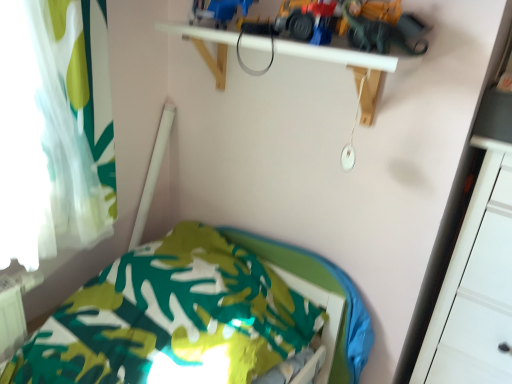
This screenshot has width=512, height=384. Describe the element at coordinates (194, 315) in the screenshot. I see `green fabric bed at lower left` at that location.

Image resolution: width=512 pixels, height=384 pixels. I want to click on white matte shelf at upper center, so click(x=323, y=53).

Locate an element on the screen. blue plastic toy truck at upper center, the second toy in the right-to-left sequence is located at coordinates (218, 11).

What is the approximate width of yellow plastic toy car at upper center, arranged as the first toy car when viewed from the right?

yellow plastic toy car at upper center, arranged as the first toy car when viewed from the right, is 1.45 inches in width.

What do you see at coordinates (476, 293) in the screenshot? I see `white glossy drawer at right` at bounding box center [476, 293].

This screenshot has width=512, height=384. What do you see at coordinates (72, 119) in the screenshot? I see `white sheer curtain at left` at bounding box center [72, 119].

Where is `green fabric bed at lower left`? Image resolution: width=512 pixels, height=384 pixels. green fabric bed at lower left is located at coordinates (194, 315).

From their relative heights in the image, would you say white sheer curtain at left is taller or shorter than white matte shelf at upper center?

Clearly, white sheer curtain at left is taller compared to white matte shelf at upper center.

Is white matte shelf at upper center at the back of white sheer curtain at left?

No, white matte shelf at upper center is not at the back of white sheer curtain at left.

Is white sheer curtain at left completely or partially outside of white matte shelf at upper center?

Yes, white sheer curtain at left is located beyond the bounds of white matte shelf at upper center.

Consider the image. From the image's perspective, is white sheer curtain at left located beneath white matte shelf at upper center?

Yes.

Does point (482, 284) come farther from viewer compared to point (404, 42)?

That is True.

Image resolution: width=512 pixels, height=384 pixels. Find the location of `toy car that is the 1st object to the left of the white glossy drawer at right, starting at the anchor`. toy car that is the 1st object to the left of the white glossy drawer at right, starting at the anchor is located at coordinates (383, 27).

Between white glossy drawer at right and yellow plastic toy car at upper center, arranged as the first toy car when viewed from the right, which one has smaller size?

yellow plastic toy car at upper center, arranged as the first toy car when viewed from the right, is smaller.

Can you confirm if white glossy drawer at right is positioned to the right of yellow plastic toy car at upper center, placed as the second toy car when sorted from left to right?

Yes.

From a real-world perspective, relative to white glossy drawer at right, is yellow plastic toy car at upper center, arranged as the first toy car when viewed from the right, vertically above or below?

From a real-world perspective, yellow plastic toy car at upper center, arranged as the first toy car when viewed from the right, is physically above white glossy drawer at right.

Is yellow plastic toy car at upper center, arranged as the first toy car when viewed from the right, at the right side of white glossy drawer at right?

In fact, yellow plastic toy car at upper center, arranged as the first toy car when viewed from the right, is to the left of white glossy drawer at right.

Image resolution: width=512 pixels, height=384 pixels. I want to click on drawer directly beneath the yellow plastic toy car at upper center, arranged as the first toy car when viewed from the right (from a real-world perspective), so [x=476, y=293].

Which object is closer to the camera, yellow plastic toy car at upper center, arranged as the first toy car when viewed from the right, or white glossy drawer at right?

yellow plastic toy car at upper center, arranged as the first toy car when viewed from the right, is in front.

From the image's perspective, is metallic yellow construction vehicle at upper center, the 1th toy in the right-to-left sequence, above or below matte red toy car at upper center, the 2th toy car viewed from the right?

From the image's perspective, metallic yellow construction vehicle at upper center, the 1th toy in the right-to-left sequence, appears above matte red toy car at upper center, the 2th toy car viewed from the right.

Is metallic yellow construction vehicle at upper center, the 1th toy in the right-to-left sequence, in contact with matte red toy car at upper center, the 1th toy car positioned from the left?

Yes, metallic yellow construction vehicle at upper center, the 1th toy in the right-to-left sequence, is beside matte red toy car at upper center, the 1th toy car positioned from the left.

Consider the image. Is metallic yellow construction vehicle at upper center, the 1th toy in the right-to-left sequence, facing towards matte red toy car at upper center, the 2th toy car viewed from the right?

Yes, metallic yellow construction vehicle at upper center, the 1th toy in the right-to-left sequence, is facing matte red toy car at upper center, the 2th toy car viewed from the right.

Is metallic yellow construction vehicle at upper center, which is the second toy in left-to-right order, spatially inside matte red toy car at upper center, the 2th toy car viewed from the right, or outside of it?

metallic yellow construction vehicle at upper center, which is the second toy in left-to-right order, is not inside matte red toy car at upper center, the 2th toy car viewed from the right, it's outside.

Considering the relative positions of blue plastic toy truck at upper center, the 1th toy positioned from the left, and matte red toy car at upper center, the 2th toy car viewed from the right, in the image provided, is blue plastic toy truck at upper center, the 1th toy positioned from the left, to the left of matte red toy car at upper center, the 2th toy car viewed from the right, from the viewer's perspective?

Yes.

Are blue plastic toy truck at upper center, the second toy in the right-to-left sequence, and matte red toy car at upper center, the 1th toy car positioned from the left, making contact?

No, blue plastic toy truck at upper center, the second toy in the right-to-left sequence, is not making contact with matte red toy car at upper center, the 1th toy car positioned from the left.

Choose the correct answer: Is blue plastic toy truck at upper center, the 1th toy positioned from the left, inside matte red toy car at upper center, the 1th toy car positioned from the left, or outside it?

blue plastic toy truck at upper center, the 1th toy positioned from the left, exists outside the volume of matte red toy car at upper center, the 1th toy car positioned from the left.

From the image's perspective, is blue plastic toy truck at upper center, the 1th toy positioned from the left, located beneath matte red toy car at upper center, the 2th toy car viewed from the right?

Incorrect, from the image's perspective, blue plastic toy truck at upper center, the 1th toy positioned from the left, is higher than matte red toy car at upper center, the 2th toy car viewed from the right.

From the image's perspective, which toy is the 2nd one above the white glossy drawer at right? Please provide its 2D coordinates.

[(218, 11)]

Which is more to the right, white glossy drawer at right or blue plastic toy truck at upper center, the second toy in the right-to-left sequence?

white glossy drawer at right.

Would you say white glossy drawer at right is outside blue plastic toy truck at upper center, the 1th toy positioned from the left?

Absolutely, white glossy drawer at right is external to blue plastic toy truck at upper center, the 1th toy positioned from the left.

Does white glossy drawer at right have a larger size compared to blue plastic toy truck at upper center, the 1th toy positioned from the left?

Indeed, white glossy drawer at right has a larger size compared to blue plastic toy truck at upper center, the 1th toy positioned from the left.

Is blue plastic toy truck at upper center, the 1th toy positioned from the left, facing towards yellow plastic toy car at upper center, arranged as the first toy car when viewed from the right?

No, blue plastic toy truck at upper center, the 1th toy positioned from the left, is not oriented towards yellow plastic toy car at upper center, arranged as the first toy car when viewed from the right.

Consider the image. Is blue plastic toy truck at upper center, the second toy in the right-to-left sequence, not inside yellow plastic toy car at upper center, arranged as the first toy car when viewed from the right?

That's correct, blue plastic toy truck at upper center, the second toy in the right-to-left sequence, is outside of yellow plastic toy car at upper center, arranged as the first toy car when viewed from the right.

Who is bigger, blue plastic toy truck at upper center, the second toy in the right-to-left sequence, or yellow plastic toy car at upper center, arranged as the first toy car when viewed from the right?

blue plastic toy truck at upper center, the second toy in the right-to-left sequence, is bigger.

How many degrees apart are the facing directions of blue plastic toy truck at upper center, the second toy in the right-to-left sequence, and yellow plastic toy car at upper center, placed as the second toy car when sorted from left to right?

The angle between the facing direction of blue plastic toy truck at upper center, the second toy in the right-to-left sequence, and the facing direction of yellow plastic toy car at upper center, placed as the second toy car when sorted from left to right, is 45.9 degrees.

You are a GUI agent. You are given a task and a screenshot of the screen. Output one action in this format:
    pyautogui.click(x=<x>, y=<y>)
    Task: Click on the table positioned vertically above the white sheer curtain at left (from a real-world perspective)
    
    Given the screenshot: What is the action you would take?
    pyautogui.click(x=323, y=53)

This screenshot has height=384, width=512. Find the location of `the 1st toy car to the left of the white glossy drawer at right, counting from the anchor's position`. the 1st toy car to the left of the white glossy drawer at right, counting from the anchor's position is located at coordinates (383, 27).

When comparing their distances from white glossy drawer at right, does green fabric bed at lower left or matte red toy car at upper center, the 1th toy car positioned from the left, seem closer?

Among the two, green fabric bed at lower left is located nearer to white glossy drawer at right.

From the image, which object appears to be farther from white matte shelf at upper center, white glossy drawer at right or blue plastic toy truck at upper center, the second toy in the right-to-left sequence?

white glossy drawer at right is positioned further to the anchor white matte shelf at upper center.

Considering their positions, is matte red toy car at upper center, the 1th toy car positioned from the left, positioned closer to yellow plastic toy car at upper center, arranged as the first toy car when viewed from the right, than white glossy drawer at right?

matte red toy car at upper center, the 1th toy car positioned from the left, is positioned closer to the anchor yellow plastic toy car at upper center, arranged as the first toy car when viewed from the right.

Looking at the image, which one is located closer to yellow plastic toy car at upper center, arranged as the first toy car when viewed from the right, green fabric bed at lower left or white sheer curtain at left?

white sheer curtain at left.

Estimate the real-world distances between objects in this image. Which object is closer to blue plastic toy truck at upper center, the second toy in the right-to-left sequence, matte red toy car at upper center, the 1th toy car positioned from the left, or white sheer curtain at left?

matte red toy car at upper center, the 1th toy car positioned from the left, lies closer to blue plastic toy truck at upper center, the second toy in the right-to-left sequence, than the other object.

Estimate the real-world distances between objects in this image. Which object is closer to yellow plastic toy car at upper center, placed as the second toy car when sorted from left to right, white matte shelf at upper center or white sheer curtain at left?

white matte shelf at upper center is positioned closer to the anchor yellow plastic toy car at upper center, placed as the second toy car when sorted from left to right.

From the image, which object appears to be nearer to blue plastic toy truck at upper center, the 1th toy positioned from the left, white glossy drawer at right or green fabric bed at lower left?

green fabric bed at lower left is positioned closer to the anchor blue plastic toy truck at upper center, the 1th toy positioned from the left.

When comparing their distances from metallic yellow construction vehicle at upper center, which is the second toy in left-to-right order, does white glossy drawer at right or matte red toy car at upper center, the 2th toy car viewed from the right, seem closer?

Among the two, matte red toy car at upper center, the 2th toy car viewed from the right, is located nearer to metallic yellow construction vehicle at upper center, which is the second toy in left-to-right order.

You are a GUI agent. You are given a task and a screenshot of the screen. Output one action in this format:
    pyautogui.click(x=<x>, y=<y>)
    Task: Click on the table between white sheer curtain at left and matte red toy car at upper center, the 2th toy car viewed from the right, in the horizontal direction
    This screenshot has height=384, width=512.
    Given the screenshot: What is the action you would take?
    pyautogui.click(x=323, y=53)

Locate an element on the screen. This screenshot has width=512, height=384. curtain between matte red toy car at upper center, the 2th toy car viewed from the right, and green fabric bed at lower left in the up-down direction is located at coordinates (72, 119).

Find the location of a particular element. This screenshot has height=384, width=512. toy between white matte shelf at upper center and yellow plastic toy car at upper center, placed as the second toy car when sorted from left to right, in the horizontal direction is located at coordinates (345, 25).

The height and width of the screenshot is (384, 512). Identify the location of drawer between metallic yellow construction vehicle at upper center, the 1th toy in the right-to-left sequence, and green fabric bed at lower left vertically. (476, 293).